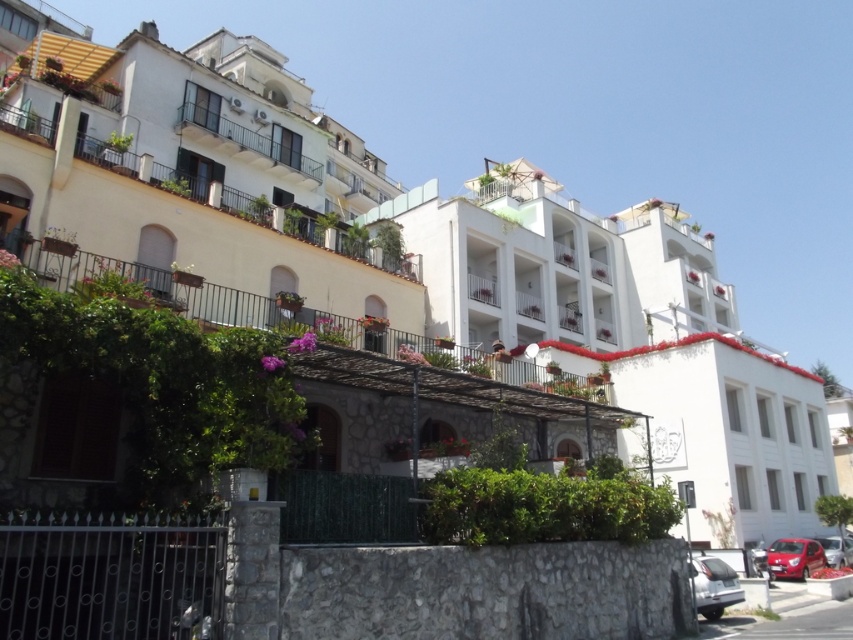
Does silver metallic car at lower right have a larger size compared to shiny red car at lower right?

Indeed, silver metallic car at lower right has a larger size compared to shiny red car at lower right.

What do you see at coordinates (714, 586) in the screenshot? This screenshot has height=640, width=853. I see `silver metallic car at lower right` at bounding box center [714, 586].

Find the location of a particular element. silver metallic car at lower right is located at coordinates (714, 586).

Which is behind, point (630, 317) or point (782, 547)?

Point (630, 317)

Can you confirm if white stone building at center is positioned to the right of shiny red car at lower right?

Incorrect, white stone building at center is not on the right side of shiny red car at lower right.

Where is `white stone building at center`? This screenshot has height=640, width=853. white stone building at center is located at coordinates (628, 337).

You are a GUI agent. You are given a task and a screenshot of the screen. Output one action in this format:
    pyautogui.click(x=<x>, y=<y>)
    Task: Click on the white stone building at center
    
    Given the screenshot: What is the action you would take?
    pyautogui.click(x=628, y=337)

Who is higher up, metallic balcony at upper center or metallic red car at lower right?

Positioned higher is metallic balcony at upper center.

Who is more distant from viewer, (186, 116) or (827, 557)?

Point (186, 116)

Which is in front, point (293, 156) or point (851, 538)?

Point (851, 538) is more forward.

This screenshot has height=640, width=853. In order to click on metallic balcony at upper center in this screenshot , I will do `click(245, 132)`.